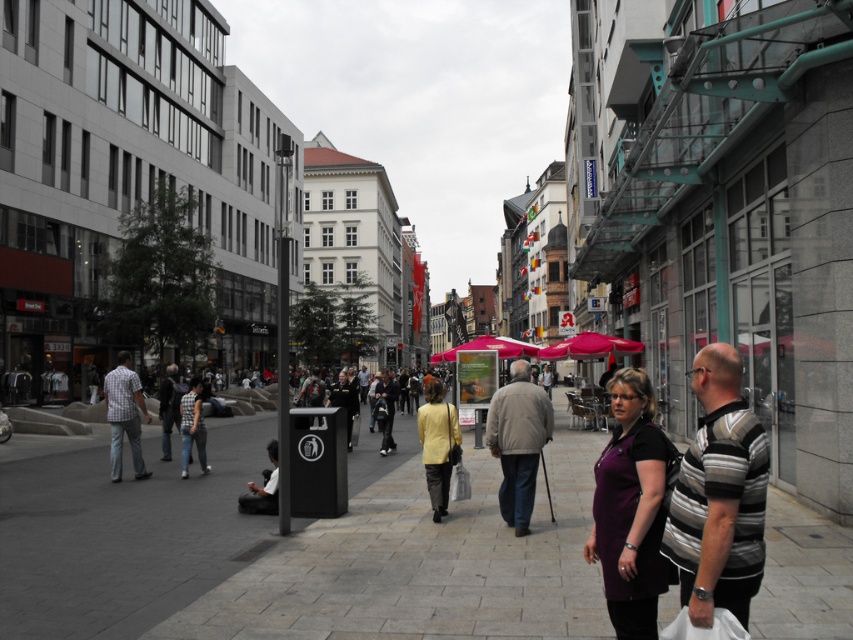
Measure the distance from gray concrete pavement at center to striped cotton shirt at lower right.

The distance of gray concrete pavement at center from striped cotton shirt at lower right is 9.89 meters.

From the picture: Who is more distant from viewer, [827,600] or [722,496]?

Point [827,600]

Who is more distant from viewer, (517, 584) or (729, 369)?

The point (517, 584) is behind.

Locate an element on the screen. gray concrete pavement at center is located at coordinates (x=289, y=547).

Who is higher up, dark gray jeans at center or dark blue uniform at center?

Positioned higher is dark gray jeans at center.

The width and height of the screenshot is (853, 640). In order to click on dark gray jeans at center in this screenshot , I will do `click(169, 406)`.

Locate an element on the screen. The height and width of the screenshot is (640, 853). dark gray jeans at center is located at coordinates (169, 406).

This screenshot has height=640, width=853. What do you see at coordinates (125, 416) in the screenshot?
I see `light gray cotton pants at center` at bounding box center [125, 416].

Who is higher up, light gray cotton pants at center or striped shirt at center?

striped shirt at center is higher up.

Image resolution: width=853 pixels, height=640 pixels. I want to click on light gray cotton pants at center, so click(x=125, y=416).